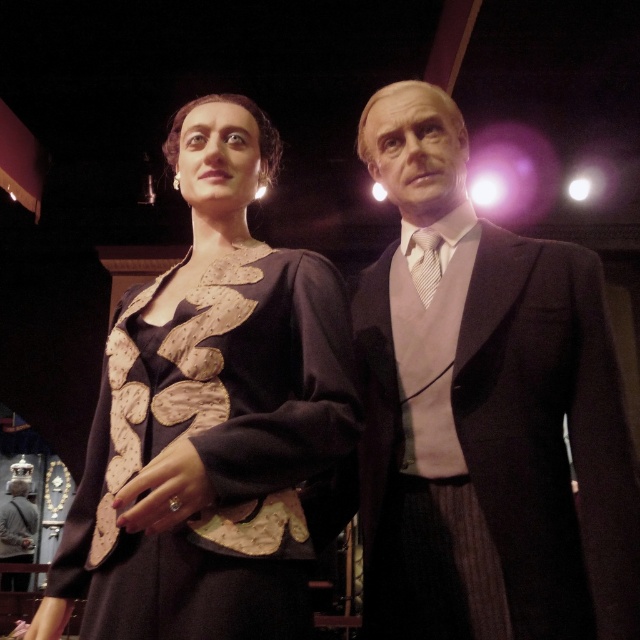
You are an interior designer assessing the spatial arrangement of two black garments in a display case. The matte black suit at right and the matte black dress at center are both displayed. Given that the display case has a height limit of 1.5 meters, can both items be displayed without exceeding the height restriction?

The matte black suit at right has a greater height compared to the matte black dress at center. Since the display case has a height limit of 1.5 meters, both items can be displayed without exceeding the height restriction as long as their individual heights are under 1.5 meters. However, the exact dimensions of each item are needed to confirm compliance.

You are a security guard in a museum and need to check the height of the matte black suit at right and the matte black dress at center. Which one is positioned lower in the image?

The matte black suit at right is below the matte black dress at center, so the matte black suit at right is positioned lower in the image.